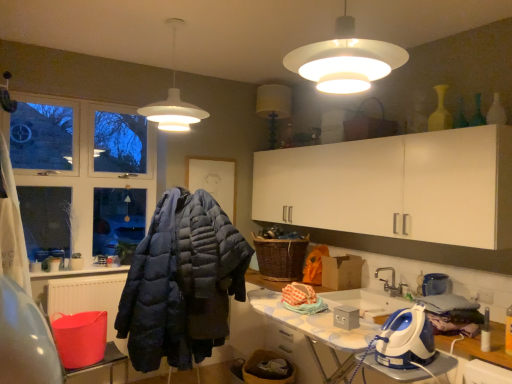
Find the location of a particular element. This screenshot has width=512, height=384. dark blue quilted jacket at center is located at coordinates pos(182,282).

In order to click on white glossy ironing board at lower right in this screenshot , I will do `click(486, 353)`.

Find the location of a particular element. white matte lampshade at upper center, which is the 2th lamp from left to right is located at coordinates (345, 60).

What do you see at coordinates (173, 101) in the screenshot?
I see `white matte pendant light at upper center, which is counted as the 1th lamp, starting from the left` at bounding box center [173, 101].

What is the approximate width of white matte pendant light at upper center, the 2th lamp from the right?

The width of white matte pendant light at upper center, the 2th lamp from the right, is 49.72 centimeters.

Describe the element at coordinates (406, 339) in the screenshot. I see `blue plastic iron at lower right` at that location.

This screenshot has width=512, height=384. What are the coordinates of `dark blue quilted jacket at center` in the screenshot? It's located at (182, 282).

Is white matte pendant light at upper center, the first lamp when ordered from back to front, not near blue plastic iron at lower right?

Yes.

Is white matte pendant light at upper center, the 2th lamp from the right, taller or shorter than blue plastic iron at lower right?

Considering their sizes, white matte pendant light at upper center, the 2th lamp from the right, has more height than blue plastic iron at lower right.

Is point (176, 100) farther from viewer compared to point (379, 355)?

Yes, it is.

Considering the relative positions of white matte pendant light at upper center, which is counted as the 1th lamp, starting from the left, and blue plastic iron at lower right in the image provided, is white matte pendant light at upper center, which is counted as the 1th lamp, starting from the left, to the right of blue plastic iron at lower right from the viewer's perspective?

In fact, white matte pendant light at upper center, which is counted as the 1th lamp, starting from the left, is to the left of blue plastic iron at lower right.

From the image's perspective, between blue plastic iron at lower right and woven brown laundry basket at center, who is located below?

blue plastic iron at lower right, from the image's perspective.

Is point (421, 359) behind point (276, 270)?

No, it is not.

Is blue plastic iron at lower right not within woven brown laundry basket at center?

Yes.

From a real-world perspective, is white matte lampshade at upper center, arranged as the first lamp when viewed from the front, positioned under silver metallic faucet at lower center based on gravity?

Actually, white matte lampshade at upper center, arranged as the first lamp when viewed from the front, is physically above silver metallic faucet at lower center in the real world.

Considering the sizes of objects white matte lampshade at upper center, which is the 1th lamp from right to left, and silver metallic faucet at lower center in the image provided, who is shorter, white matte lampshade at upper center, which is the 1th lamp from right to left, or silver metallic faucet at lower center?

silver metallic faucet at lower center.

Is white matte lampshade at upper center, arranged as the first lamp when viewed from the front, aimed at silver metallic faucet at lower center?

No, white matte lampshade at upper center, arranged as the first lamp when viewed from the front, is not turned towards silver metallic faucet at lower center.

Which of these two, white matte lampshade at upper center, arranged as the first lamp when viewed from the front, or silver metallic faucet at lower center, is smaller?

silver metallic faucet at lower center.

Based on their positions, is woven brown laundry basket at center located to the left or right of white glossy ironing board at lower right?

Based on their positions, woven brown laundry basket at center is located to the left of white glossy ironing board at lower right.

Is the depth of woven brown laundry basket at center greater than that of white glossy ironing board at lower right?

Yes, the depth of woven brown laundry basket at center is greater than that of white glossy ironing board at lower right.

Does woven brown laundry basket at center contain white glossy ironing board at lower right?

No, woven brown laundry basket at center does not contain white glossy ironing board at lower right.

Looking at their sizes, would you say woven brown laundry basket at center is wider or thinner than white glossy ironing board at lower right?

woven brown laundry basket at center is thinner than white glossy ironing board at lower right.

How distant is dark blue quilted jacket at center from white matte pendant light at upper center, which is counted as the 1th lamp, starting from the left?

dark blue quilted jacket at center is 1.01 meters away from white matte pendant light at upper center, which is counted as the 1th lamp, starting from the left.

Looking at this image, is dark blue quilted jacket at center oriented towards white matte pendant light at upper center, which appears as the second lamp when viewed from the front?

No.

There is a dark blue quilted jacket at center. Where is `the 2nd lamp above it (from the image's perspective)`? The image size is (512, 384). the 2nd lamp above it (from the image's perspective) is located at coordinates 173,101.

Does dark blue quilted jacket at center have a larger size compared to white matte pendant light at upper center, which appears as the second lamp when viewed from the front?

Indeed, dark blue quilted jacket at center has a larger size compared to white matte pendant light at upper center, which appears as the second lamp when viewed from the front.

Based on the photo, in the image, is woven brown laundry basket at center positioned in front of or behind silver metallic faucet at lower center?

Clearly, woven brown laundry basket at center is behind silver metallic faucet at lower center.

Is woven brown laundry basket at center facing away from silver metallic faucet at lower center?

No, woven brown laundry basket at center's orientation is not away from silver metallic faucet at lower center.

Which of these two, woven brown laundry basket at center or silver metallic faucet at lower center, is wider?

Wider between the two is woven brown laundry basket at center.

Which is in front, point (284, 256) or point (182, 122)?

Positioned in front is point (182, 122).

Considering the sizes of objects woven brown laundry basket at center and white matte pendant light at upper center, the 2th lamp from the right, in the image provided, who is taller, woven brown laundry basket at center or white matte pendant light at upper center, the 2th lamp from the right,?

white matte pendant light at upper center, the 2th lamp from the right.

Is woven brown laundry basket at center positioned behind white matte pendant light at upper center, which is counted as the 1th lamp, starting from the left?

That is True.

From a real-world perspective, who is located lower, woven brown laundry basket at center or white matte pendant light at upper center, which is counted as the 1th lamp, starting from the left?

woven brown laundry basket at center.

Where is `lamp behind the blue plastic iron at lower right`? The height and width of the screenshot is (384, 512). lamp behind the blue plastic iron at lower right is located at coordinates (173, 101).

At what (x,y) coordinates should I click in order to perform the action: click on appliance that appears in front of the woven brown laundry basket at center. Please return your answer as a coordinate pair (x, y). The width and height of the screenshot is (512, 384). Looking at the image, I should click on (406, 339).

Based on their spatial positions, is white glossy ironing board at lower right or white matte lampshade at upper center, which is the 2th lamp from left to right, closer to dark blue quilted jacket at center?

white glossy ironing board at lower right is positioned closer to the anchor dark blue quilted jacket at center.

Considering their positions, is white matte pendant light at upper center, the 2th lamp from the right, positioned further to silver metallic faucet at lower center than white matte lampshade at upper center, the second lamp from the back?

white matte lampshade at upper center, the second lamp from the back, is positioned further to the anchor silver metallic faucet at lower center.

Considering their positions, is white matte lampshade at upper center, the second lamp from the back, positioned further to blue plastic iron at lower right than silver metallic faucet at lower center?

The object further to blue plastic iron at lower right is white matte lampshade at upper center, the second lamp from the back.

Based on the photo, considering their positions, is woven brown laundry basket at center positioned closer to silver metallic faucet at lower center than white matte lampshade at upper center, arranged as the first lamp when viewed from the front?

woven brown laundry basket at center.

Which object lies further to the anchor point blue plastic iron at lower right, silver metallic faucet at lower center or white matte lampshade at upper center, arranged as the first lamp when viewed from the front?

white matte lampshade at upper center, arranged as the first lamp when viewed from the front, is further to blue plastic iron at lower right.

Based on their spatial positions, is white matte pendant light at upper center, which appears as the second lamp when viewed from the front, or woven brown laundry basket at center closer to white glossy ironing board at lower right?

woven brown laundry basket at center lies closer to white glossy ironing board at lower right than the other object.

Looking at the image, which one is located further to dark blue quilted jacket at center, white matte pendant light at upper center, which is counted as the 1th lamp, starting from the left, or white glossy ironing board at lower right?

Among the two, white glossy ironing board at lower right is located further to dark blue quilted jacket at center.

When comparing their distances from silver metallic faucet at lower center, does white matte lampshade at upper center, the second lamp from the back, or blue plastic iron at lower right seem closer?

Among the two, blue plastic iron at lower right is located nearer to silver metallic faucet at lower center.

Image resolution: width=512 pixels, height=384 pixels. What are the coordinates of `tap that lies between white matte pendant light at upper center, which appears as the second lamp when viewed from the front, and dark blue quilted jacket at center from top to bottom` in the screenshot? It's located at (391, 282).

Where is `jacket positioned between white glossy ironing board at lower right and woven brown laundry basket at center from near to far`? This screenshot has height=384, width=512. jacket positioned between white glossy ironing board at lower right and woven brown laundry basket at center from near to far is located at coordinates (182, 282).

Locate an element on the screen. Image resolution: width=512 pixels, height=384 pixels. appliance between white matte lampshade at upper center, which is the 2th lamp from left to right, and white glossy ironing board at lower right from top to bottom is located at coordinates (406, 339).

Identify the location of tap that lies between white matte pendant light at upper center, the first lamp when ordered from back to front, and blue plastic iron at lower right from top to bottom. This screenshot has height=384, width=512. (391, 282).